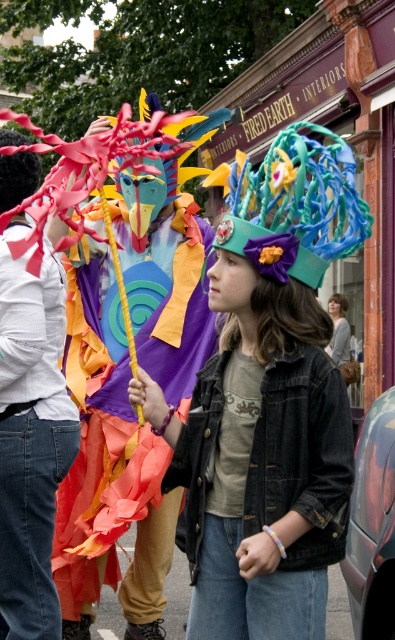
Based on the scene description, which object is positioned lower in the image, the matte black shirt at left or the light brown hair at center?

The matte black shirt at left is positioned below the light brown hair at center, so it is lower in the image.

You are a photographer at the event and want to capture a photo of the light brown hair at center without the matte black shirt at left blocking it. What should you do?

Move to the right side so that the light brown hair at center is no longer behind the matte black shirt at left.